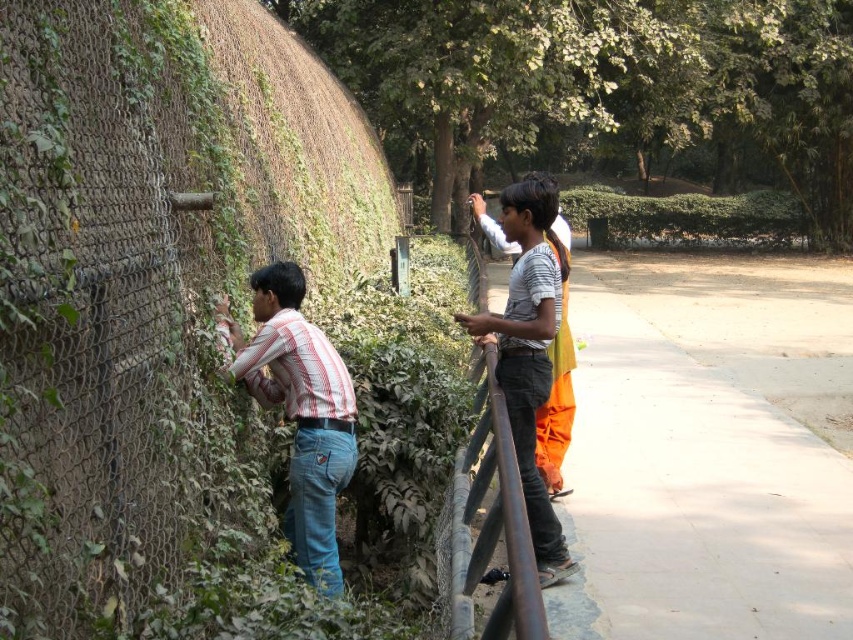
You are standing at the point with coordinates point (521,547) and want to walk to the point with coordinates point (323,417). Which direction should you face to move towards your destination?

To move from point (521,547) to point (323,417), you should face a direction that is north and west since the destination point has lower x and y coordinates compared to the starting point.

In the scene shown: You are a zookeeper trying to determine if the striped cotton shirt at left can be hung over the rusty metal rail at center. Based on their sizes, will the shirt fit over the rail without needing to be folded?

The striped cotton shirt at left is wider than the rusty metal rail at center, so it can be hung over the rail without folding since its width exceeds the rail.

In the scene shown: You are a zoo visitor trying to take a photo of an animal behind the fence. You have a striped cotton shirt at left and a rusty metal rail at center in your viewfinder. Which object should you position to the right to frame the animal better?

You should position the striped cotton shirt at left to the right since it is currently to the left of the rusty metal rail at center, allowing you to frame the animal better by moving the shirt out of the way.